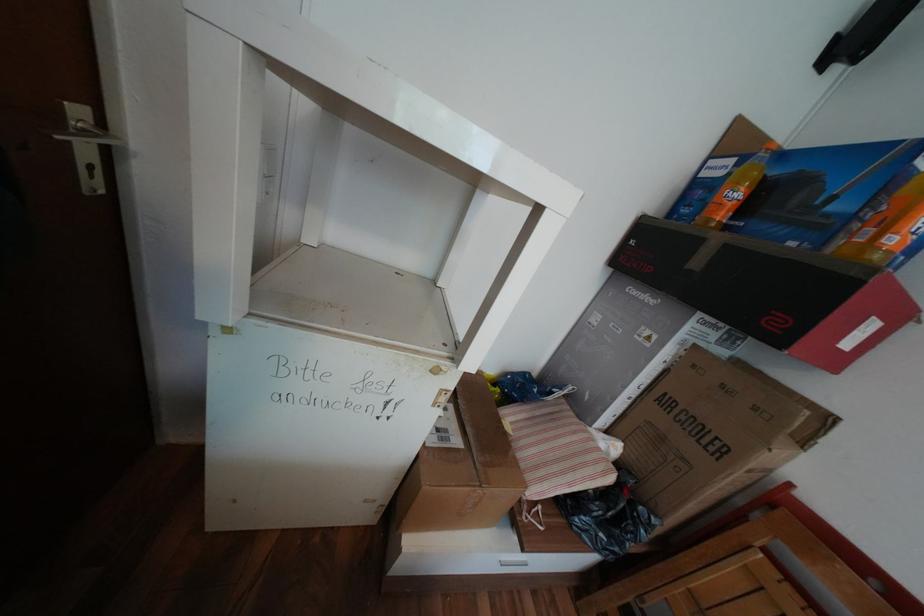
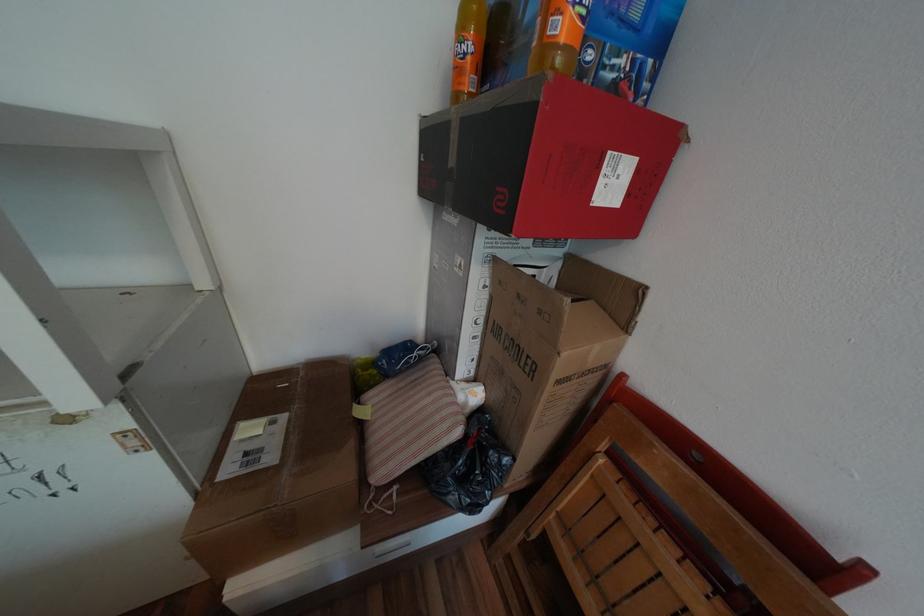
Where in the second image is the point corresponding to the point at 604,462 from the first image?

(453, 419)